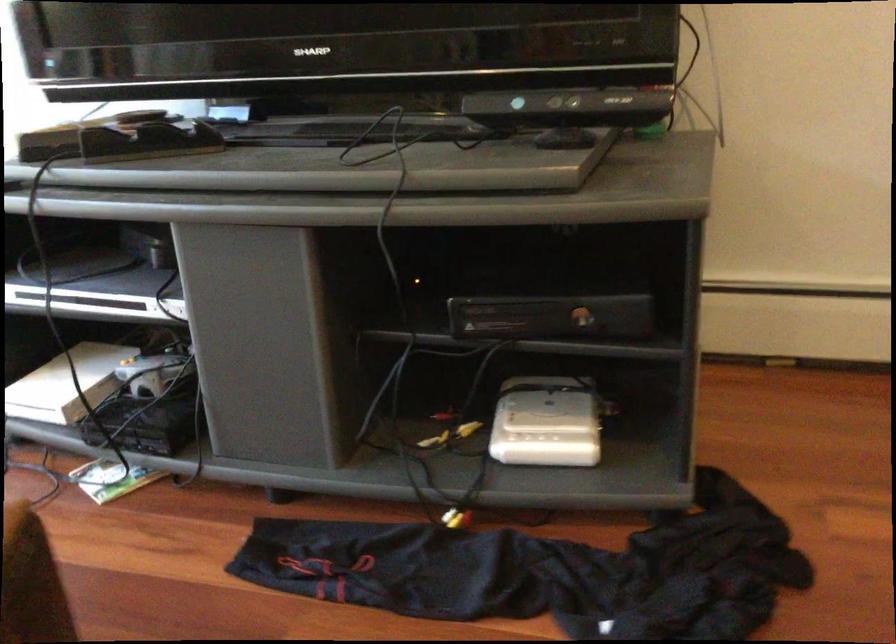
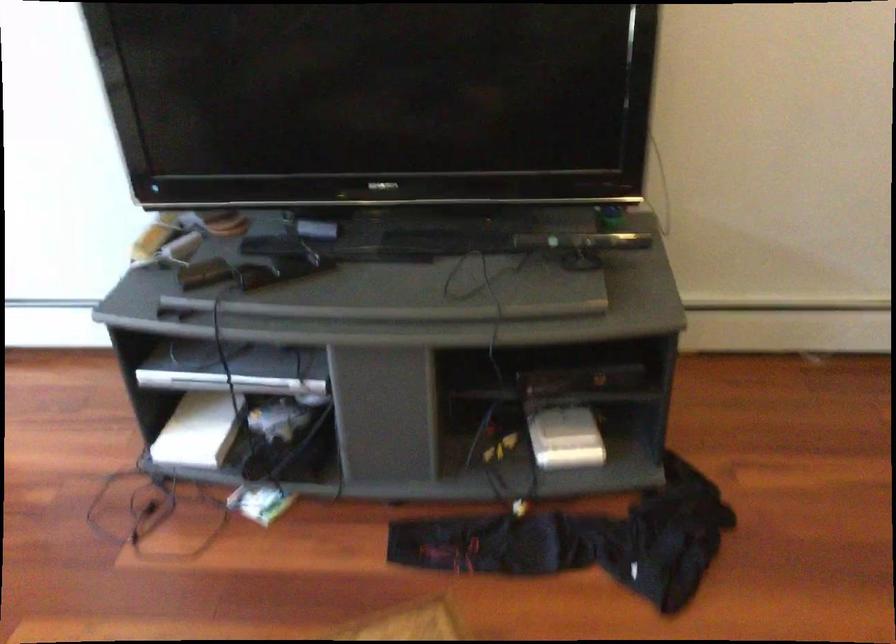
Where in the second image is the point corresponding to (543,426) from the first image?

(565, 438)